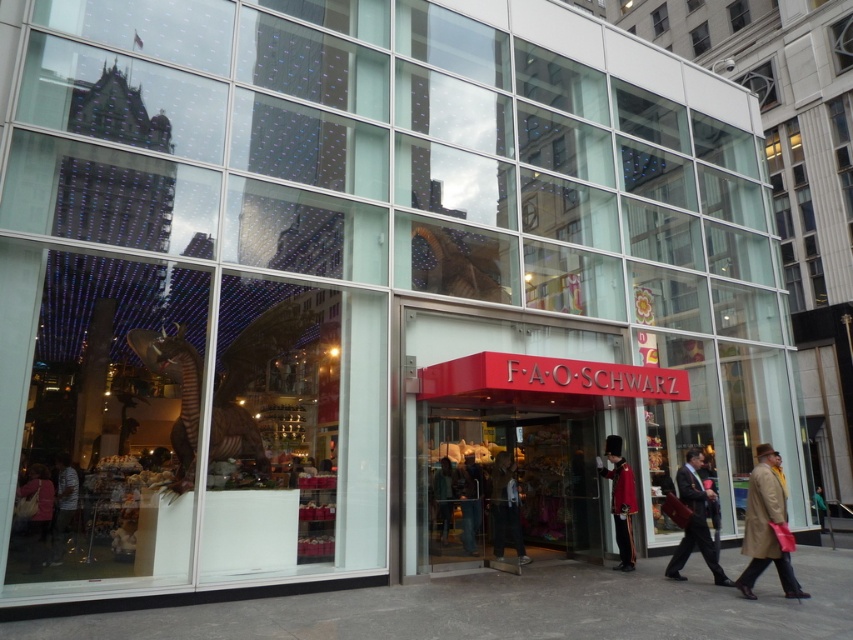
You are a customer at F.A.O. Schwarz and want to place a gift box between the dark brown leather coat at lower right and the denim jeans at center. Which object should you place the gift box closer to if the box is smaller than the coat but larger than the jeans?

The gift box should be placed closer to the denim jeans at center because it is smaller than the dark brown leather coat at lower right and larger than the denim jeans at center.

You are standing in front of F.A.O. Schwarz and want to find the dark brown leather coat at lower right. Based on the scene description, where should you look relative to the entrance?

The dark brown leather coat at lower right is located at the lower right area of the image, which corresponds to the lower right side of the store entrance.